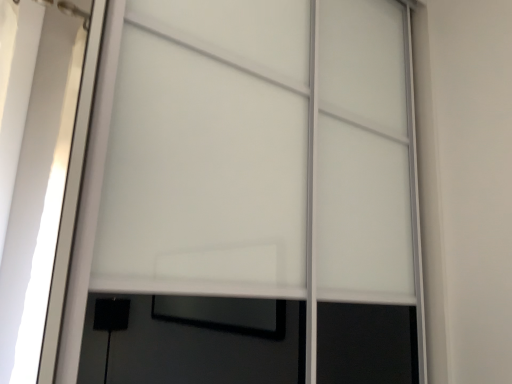
Measure the distance between point (11, 215) and camera.

A distance of 3.91 feet exists between point (11, 215) and camera.

What is the approximate height of white matte door at left?

3.59 feet.

This screenshot has width=512, height=384. Describe the element at coordinates (41, 171) in the screenshot. I see `white matte door at left` at that location.

This screenshot has height=384, width=512. Find the location of `white matte door at left`. white matte door at left is located at coordinates (41, 171).

Image resolution: width=512 pixels, height=384 pixels. I want to click on white matte door at left, so click(41, 171).